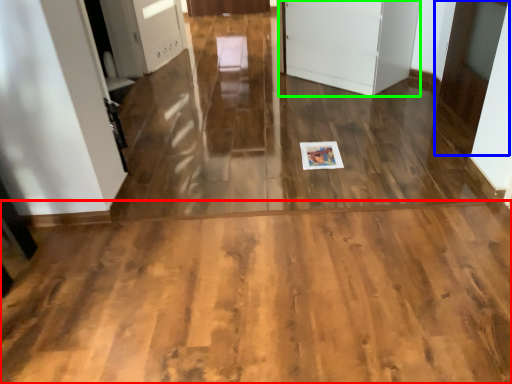
Question: Considering the real-world distances, which object is farthest from corridor (highlighted by a red box)? door (highlighted by a blue box) or door (highlighted by a green box)?

Choices:
 (A) door
 (B) door

Answer: (B)